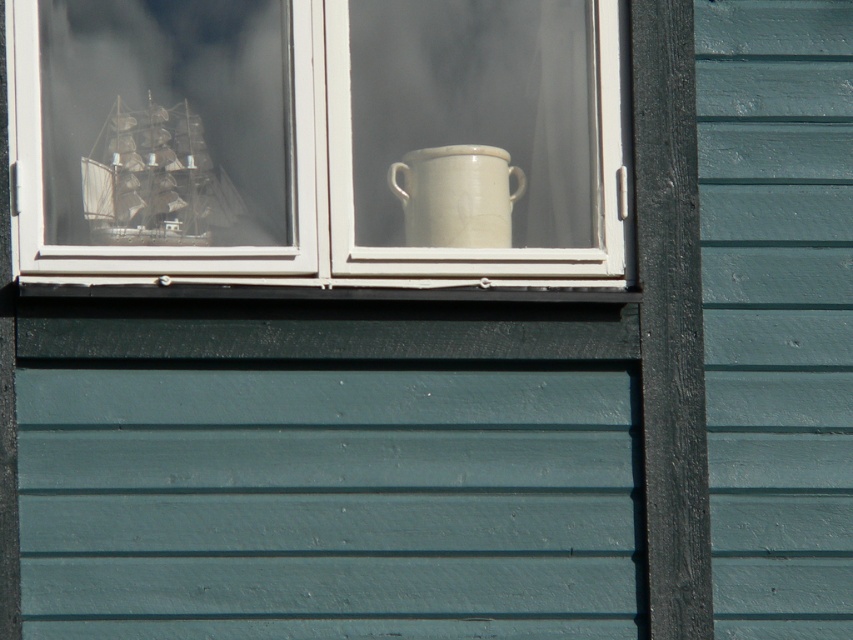
Can you confirm if white glossy pot at center is wider than wooden ship at left?

Yes, white glossy pot at center is wider than wooden ship at left.

Between white glossy pot at center and wooden ship at left, which one is positioned higher?

white glossy pot at center is above.

What do you see at coordinates (317, 141) in the screenshot? I see `white glossy pot at center` at bounding box center [317, 141].

Where is `white glossy pot at center`? The width and height of the screenshot is (853, 640). white glossy pot at center is located at coordinates (317, 141).

Between point (788, 36) and point (225, 211), which one is positioned in front?

Positioned in front is point (788, 36).

Does teal painted wood siding at right appear on the left side of wooden ship at left?

Incorrect, teal painted wood siding at right is not on the left side of wooden ship at left.

This screenshot has height=640, width=853. I want to click on teal painted wood siding at right, so click(776, 310).

Where is `teal painted wood siding at right`? The height and width of the screenshot is (640, 853). teal painted wood siding at right is located at coordinates (776, 310).

Is white glossy pot at center above teal painted wood siding at right?

Yes.

Is the position of white glossy pot at center more distant than that of teal painted wood siding at right?

No, it is in front of teal painted wood siding at right.

The width and height of the screenshot is (853, 640). Identify the location of white glossy pot at center. (317, 141).